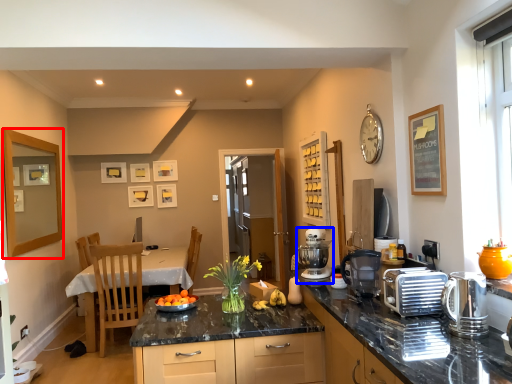
Question: Among these objects, which one is farthest to the camera, picture frame (highlighted by a red box) or mixer (highlighted by a blue box)?

Choices:
 (A) picture frame
 (B) mixer

Answer: (A)